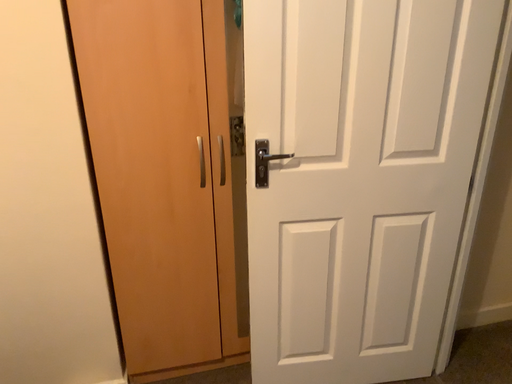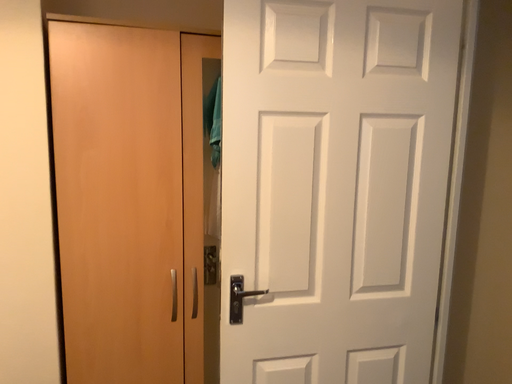
Question: How did the camera likely rotate when shooting the video?

Choices:
 (A) rotated upward
 (B) rotated downward

Answer: (A)